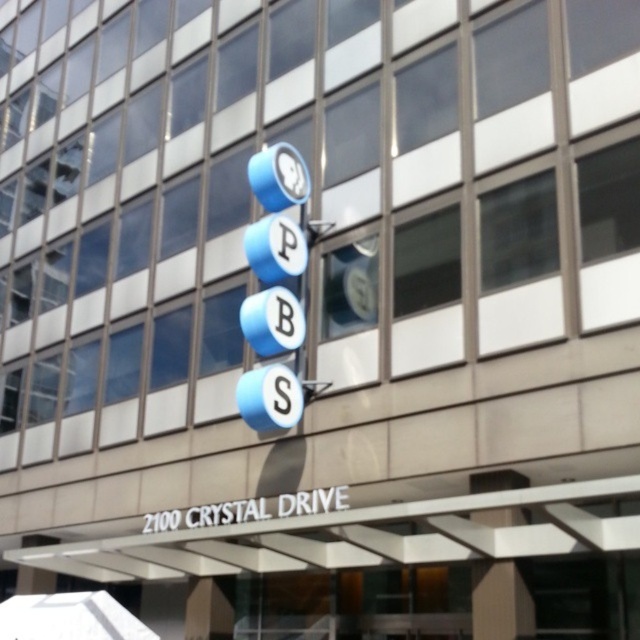
Question: Is blue metallic clock at upper center bigger than metallic blue clock at center?

Choices:
 (A) no
 (B) yes

Answer: (B)

Question: Among these objects, which one is farthest from the camera?

Choices:
 (A) blue metallic clock at upper center
 (B) metallic blue clock at center

Answer: (B)

Question: Can you confirm if blue metallic clock at upper center is positioned to the left of metallic blue clock at center?

Choices:
 (A) no
 (B) yes

Answer: (B)

Question: Is blue metallic clock at upper center to the left of metallic blue clock at center from the viewer's perspective?

Choices:
 (A) yes
 (B) no

Answer: (A)

Question: Among these points, which one is farthest from the camera?

Choices:
 (A) (298, 196)
 (B) (273, 150)

Answer: (A)